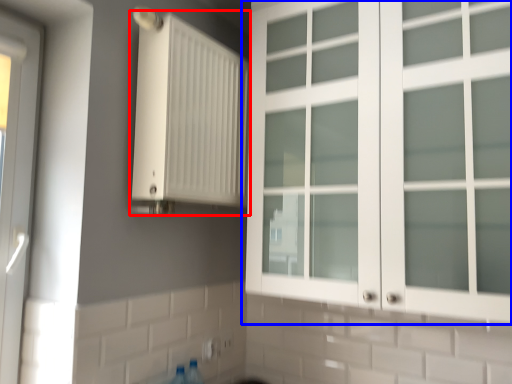
Question: Among these objects, which one is farthest to the camera, radiator (highlighted by a red box) or cupboard (highlighted by a blue box)?

Choices:
 (A) radiator
 (B) cupboard

Answer: (A)